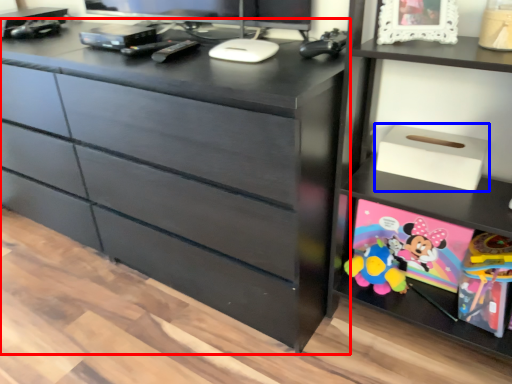
Question: Which object appears farthest to the camera in this image, chest of drawers (highlighted by a red box) or storage box (highlighted by a blue box)?

Choices:
 (A) chest of drawers
 (B) storage box

Answer: (B)